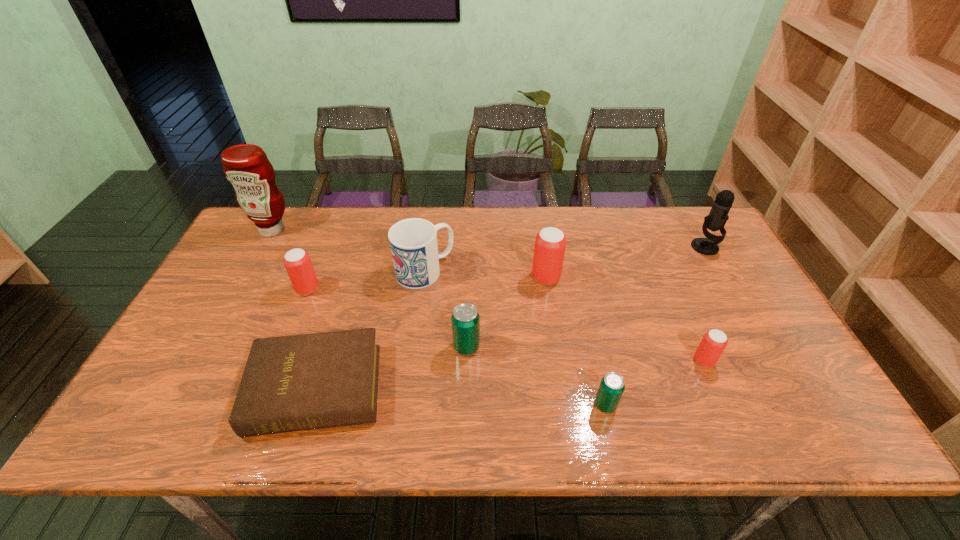
Where is `red beer can identified as the third closest to the Bible`? red beer can identified as the third closest to the Bible is located at coordinates (714, 341).

What are the coordinates of `red beer can that is the second closest to the second red beer can from left to right` in the screenshot? It's located at (297, 262).

This screenshot has height=540, width=960. Find the location of `vacant space that satisfies the following two spatial constraints: 1. on the front side of the condiment; 2. on the left side of the black microphone`. vacant space that satisfies the following two spatial constraints: 1. on the front side of the condiment; 2. on the left side of the black microphone is located at coordinates (263, 247).

At what (x,y) coordinates should I click in order to perform the action: click on free spot that satisfies the following two spatial constraints: 1. on the front side of the tallest beer can; 2. on the left side of the smaller teal beer can. Please return your answer as a coordinate pair (x, y). Image resolution: width=960 pixels, height=540 pixels. Looking at the image, I should click on (565, 405).

Identify the location of vacant position in the image that satisfies the following two spatial constraints: 1. on the front side of the rightmost red beer can; 2. on the left side of the left teal beer can. (466, 361).

Image resolution: width=960 pixels, height=540 pixels. What are the coordinates of `free space that satisfies the following two spatial constraints: 1. on the back side of the microphone; 2. on the right side of the third beer can from right to left` in the screenshot? It's located at (541, 247).